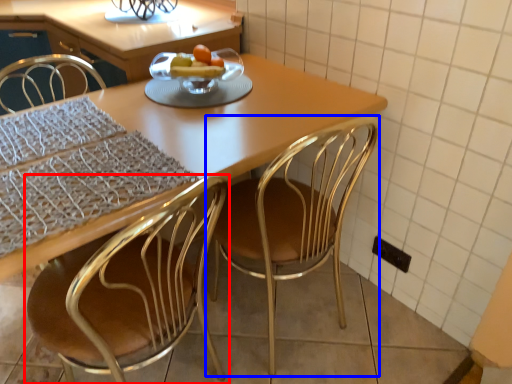
Question: Which of the following is the closest to the observer, chair (highlighted by a red box) or chair (highlighted by a blue box)?

Choices:
 (A) chair
 (B) chair

Answer: (A)